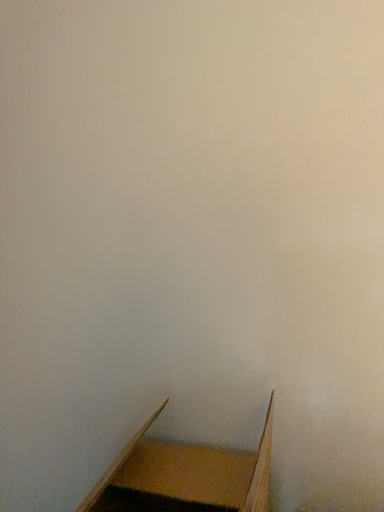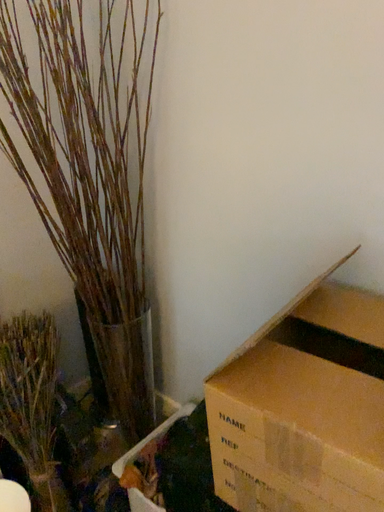
Question: Which way did the camera rotate in the video?

Choices:
 (A) rotated upward
 (B) rotated downward

Answer: (B)